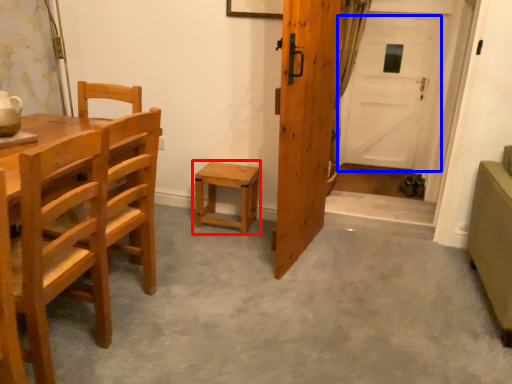
Question: Among these objects, which one is nearest to the camera, stool (highlighted by a red box) or door (highlighted by a blue box)?

Choices:
 (A) stool
 (B) door

Answer: (A)